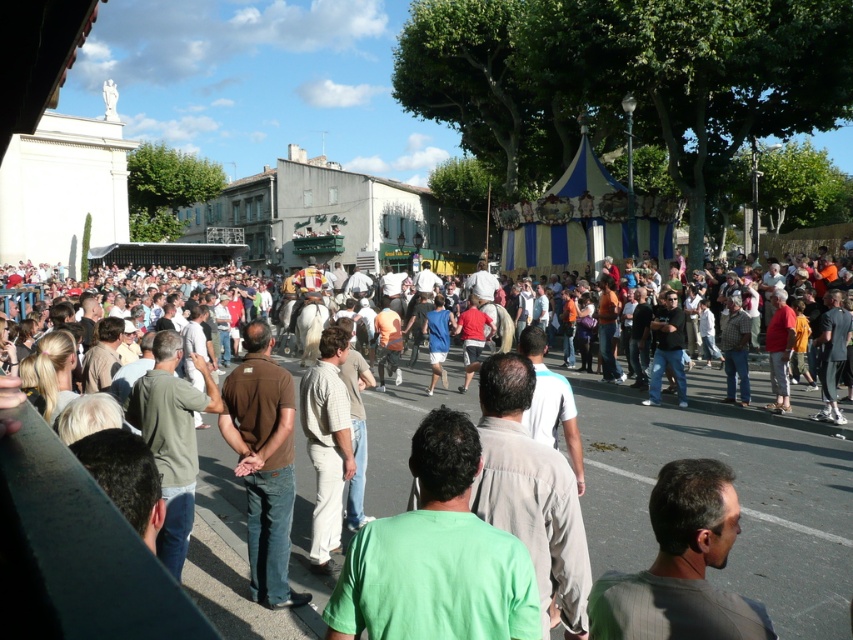
Can you confirm if light brown casual clothing at center is smaller than brown cotton shirt at center?

No.

Is light brown casual clothing at center above brown cotton shirt at center?

Correct, light brown casual clothing at center is located above brown cotton shirt at center.

Locate an element on the screen. light brown casual clothing at center is located at coordinates (740, 499).

Which is below, light brown casual clothing at center or light beige pants at center?

light beige pants at center is below.

Is light brown casual clothing at center bigger than light beige pants at center?

Yes, light brown casual clothing at center is bigger than light beige pants at center.

Image resolution: width=853 pixels, height=640 pixels. In order to click on light brown casual clothing at center in this screenshot , I will do `click(740, 499)`.

Who is more forward, (282, 390) or (334, 508)?

Positioned in front is point (282, 390).

Which of these two, brown cotton shirt at center or light beige pants at center, stands taller?

With more height is brown cotton shirt at center.

Which is in front, point (280, 582) or point (323, 376)?

Positioned in front is point (280, 582).

At what (x,y) coordinates should I click in order to perform the action: click on brown cotton shirt at center. Please return your answer as a coordinate pair (x, y). This screenshot has width=853, height=640. Looking at the image, I should click on (263, 461).